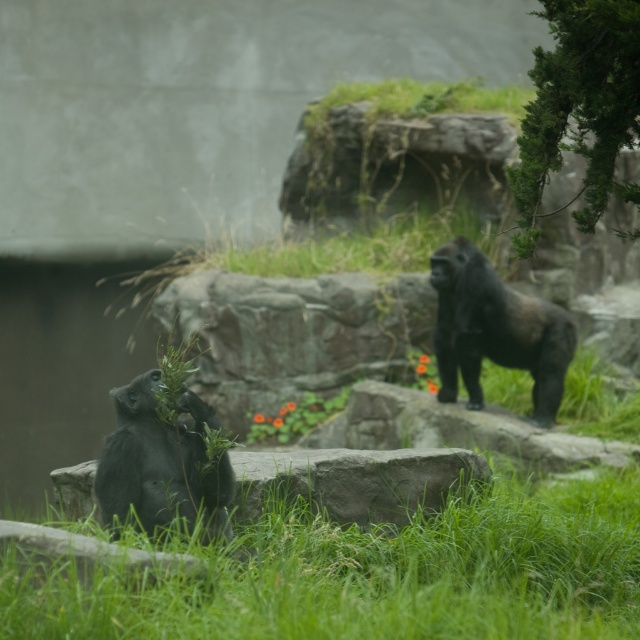
What do you see at coordinates (376, 573) in the screenshot? The image size is (640, 640). I see `green grass at lower center` at bounding box center [376, 573].

Between point (461, 508) and point (557, 35), which one is positioned in front?

Point (557, 35) is in front.

Find the location of a particular element. The width and height of the screenshot is (640, 640). green grass at lower center is located at coordinates (376, 573).

Image resolution: width=640 pixels, height=640 pixels. What are the coordinates of `green grass at lower center` in the screenshot? It's located at (376, 573).

What do you see at coordinates (496, 330) in the screenshot? I see `shiny black gorilla at upper right` at bounding box center [496, 330].

Is point (433, 257) positioned before point (188, 433)?

No, it is not.

Locate an element on the screen. The width and height of the screenshot is (640, 640). shiny black gorilla at upper right is located at coordinates [x=496, y=330].

Does green textured bush at upper right appear on the right side of shiny black gorilla at upper right?

No, green textured bush at upper right is not to the right of shiny black gorilla at upper right.

Describe the element at coordinates (579, 108) in the screenshot. This screenshot has width=640, height=640. I see `green textured bush at upper right` at that location.

Locate an element on the screen. green textured bush at upper right is located at coordinates (579, 108).